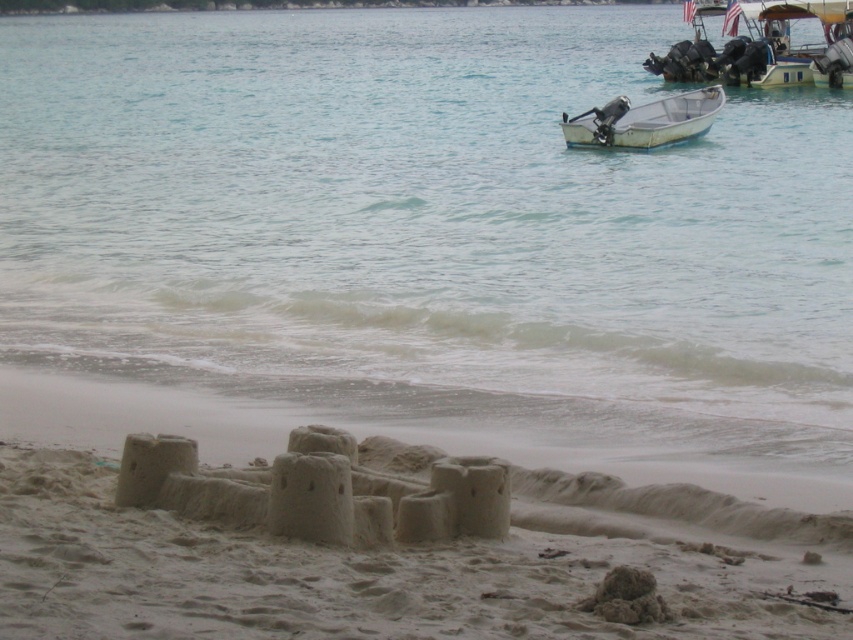
Question: Which point is farther from the camera taking this photo?

Choices:
 (A) (198, 44)
 (B) (743, 81)
 (C) (700, 100)

Answer: (A)

Question: Can you confirm if clear water at sand lower is wider than metallic silver boat at upper right?

Choices:
 (A) no
 (B) yes

Answer: (B)

Question: Does clear water at sand lower have a greater width compared to yellow plastic boat at upper right?

Choices:
 (A) no
 (B) yes

Answer: (B)

Question: Is clear water at sand lower to the left of beige sandy castle at lower center from the viewer's perspective?

Choices:
 (A) no
 (B) yes

Answer: (B)

Question: Which point is farther from the camera taking this photo?

Choices:
 (A) (834, 36)
 (B) (688, 113)

Answer: (A)

Question: Which object is farther from the camera taking this photo?

Choices:
 (A) beige sandy castle at lower center
 (B) yellow plastic boat at upper right
 (C) clear water at sand lower
 (D) metallic silver boat at upper right

Answer: (B)